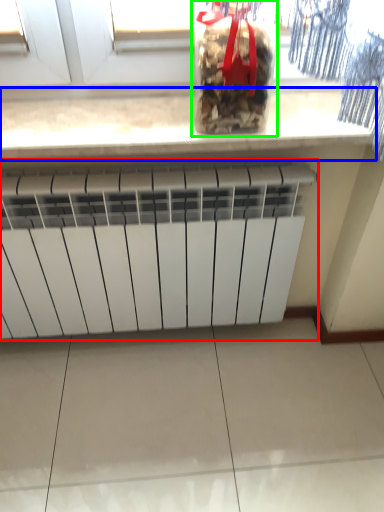
Question: Which object is positioned farthest from radiator (highlighted by a red box)? Select from countertop (highlighted by a blue box) and wine bottle (highlighted by a green box).

Choices:
 (A) countertop
 (B) wine bottle

Answer: (B)